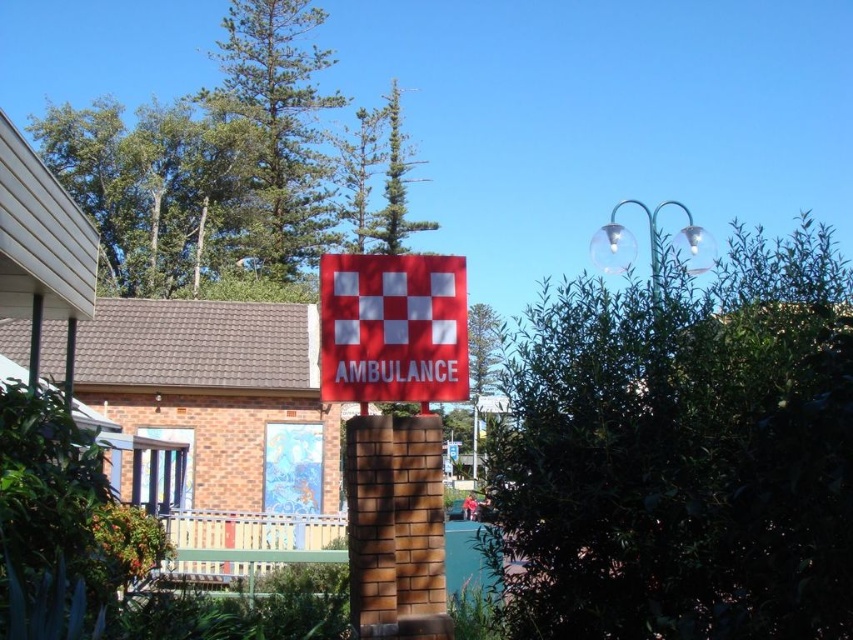
You are standing in front of the red matte sign at center and want to take a photo of it. However, there is a green leafy tree at upper center in the background. Will the tree block the entire view of the sign in your photo?

The green leafy tree at upper center is wider than the red matte sign at center, so it may partially block the sign but not entirely depending on the camera angle and distance.

You are a gardener who needs to water the green leafy bush at center and the red matte sign at center. Your watering can has a range of 4 feet. Can you water both objects without moving your position?

The distance between the green leafy bush at center and the red matte sign at center is 5.02 feet, which is greater than the watering can range of 4 feet. Therefore, you cannot water both objects without moving your position.

You are standing at the point marked by the coordinates point (683, 452). Looking around, you see the red sign mounted on a brick post and the building with a tiled roof to its left. Which direction should you face to see the green leafy bush at center?

The point marked by the coordinates point (683, 452) is where the green leafy bush at center is located, so you are already facing it.